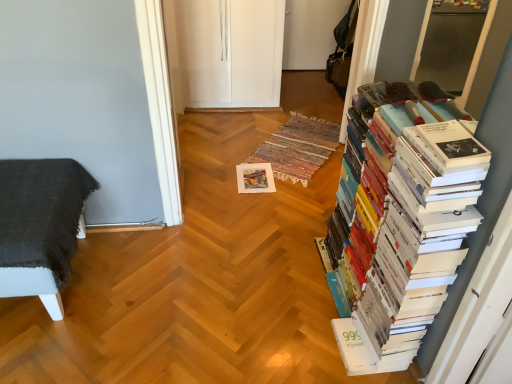
Question: Considering their positions, is dark gray woven blanket on the left located in front of or behind white paper book at right?

Choices:
 (A) behind
 (B) front

Answer: (A)

Question: Based on their positions, is dark gray woven blanket on the left located to the left or right of white paper book at right?

Choices:
 (A) left
 (B) right

Answer: (A)

Question: Considering the real-world distances, which object is farthest from the white paper book at right?

Choices:
 (A) dark gray woven blanket on the left
 (B) white paper at center

Answer: (A)

Question: Which of these objects is positioned closest to the white paper at center?

Choices:
 (A) white paper book at right
 (B) dark gray woven blanket on the left

Answer: (B)